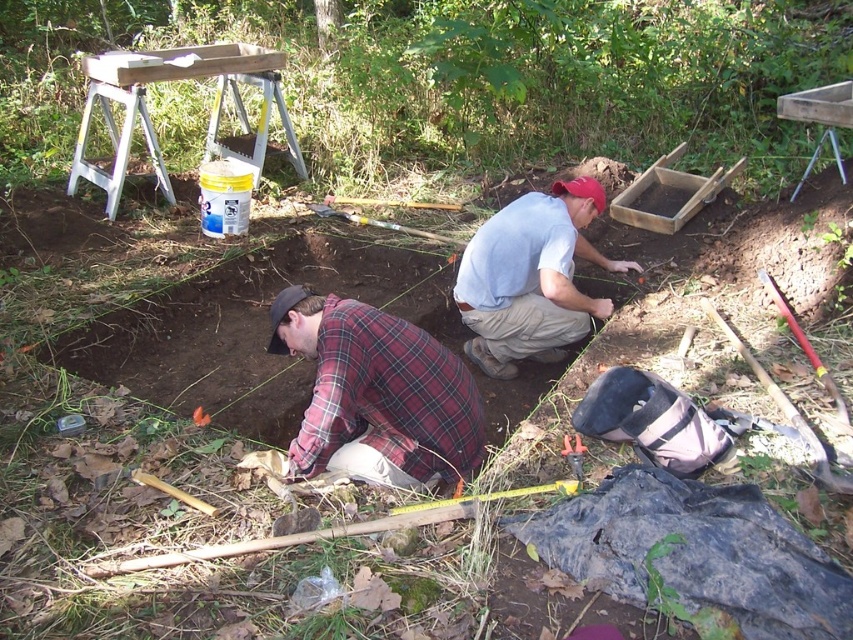
Question: Can you confirm if white cotton shirt at center is bigger than metallic silver hammer at lower center?

Choices:
 (A) no
 (B) yes

Answer: (B)

Question: Which object is positioned closest to the white cotton shirt at center?

Choices:
 (A) plaid fabric shirt at lower left
 (B) metallic silver hammer at lower center

Answer: (A)

Question: Does white cotton shirt at center come behind metallic silver hammer at lower center?

Choices:
 (A) yes
 (B) no

Answer: (A)

Question: Which of these objects is positioned closest to the plaid fabric shirt at lower left?

Choices:
 (A) metallic silver hammer at lower center
 (B) white cotton shirt at center

Answer: (A)

Question: Considering the real-world distances, which object is farthest from the metallic silver hammer at lower center?

Choices:
 (A) plaid fabric shirt at lower left
 (B) white cotton shirt at center

Answer: (B)

Question: Is plaid fabric shirt at lower left to the left of metallic silver hammer at lower center from the viewer's perspective?

Choices:
 (A) no
 (B) yes

Answer: (B)